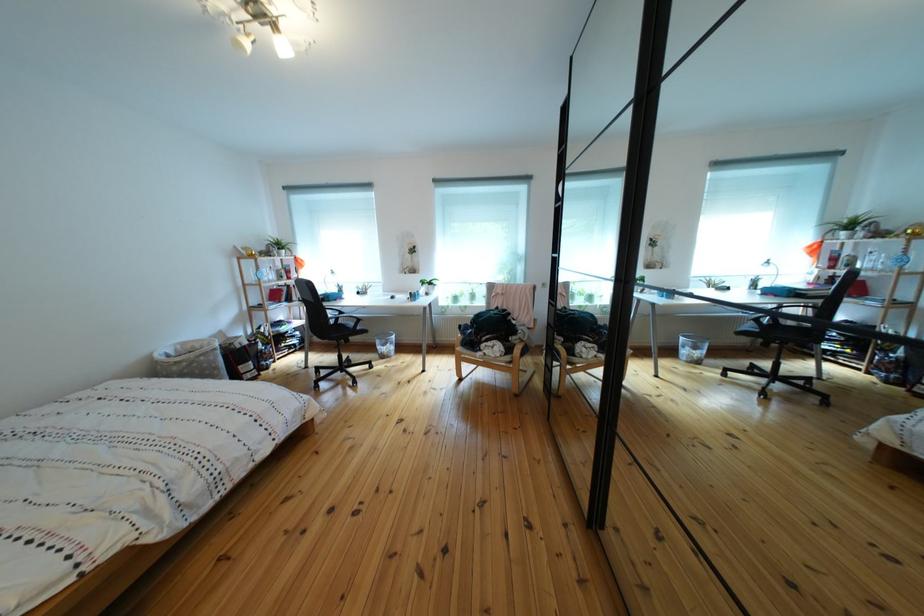
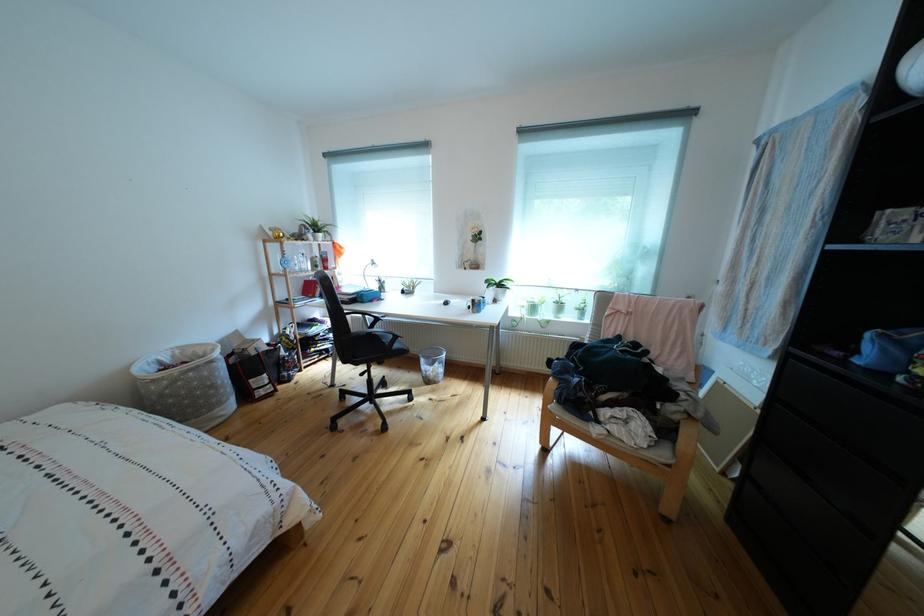
Question: What movement of the cameraman would produce the second image?

Choices:
 (A) Left
 (B) Right
 (C) Forward
 (D) Backward

Answer: (C)